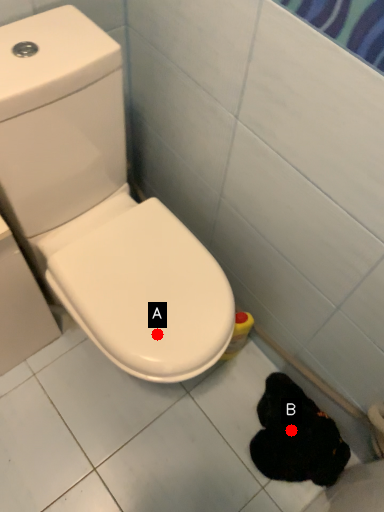
Question: Two points are circled on the image, labeled by A and B beside each circle. Which of the following is the farthest from the observer?

Choices:
 (A) A is further
 (B) B is further

Answer: (B)